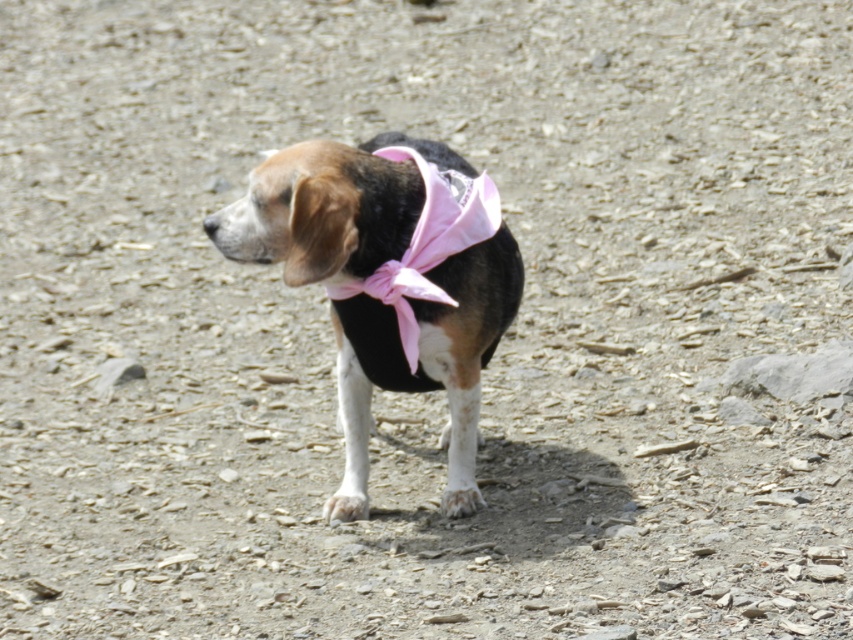
You are a photographer trying to capture the dog in the image. The dog is at point (425, 364). If you want to position the dog exactly in the center of your photo, where should you aim your camera?

The dog is already at point (425, 364), which is the center of the image, so you should aim your camera at the center to capture the dog there.

You are a photographer trying to capture the black and white fur dog at center and the pink satin bow tie at center in a single shot. Based on their positions, can you determine if the dog is standing directly beneath the bow tie?

The black and white fur dog at center is positioned under the pink satin bow tie at center, so yes, the dog is standing directly beneath the bow tie.